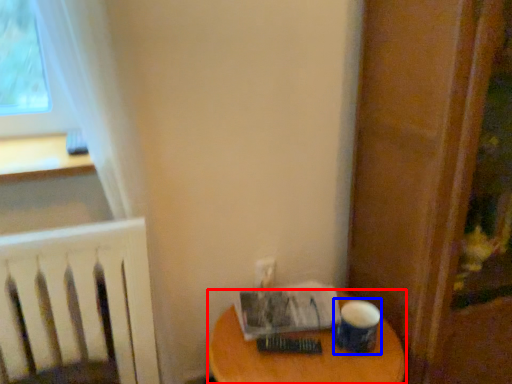
Question: Which point is further to the camera, table (highlighted by a red box) or paper cup (highlighted by a blue box)?

Choices:
 (A) table
 (B) paper cup

Answer: (B)